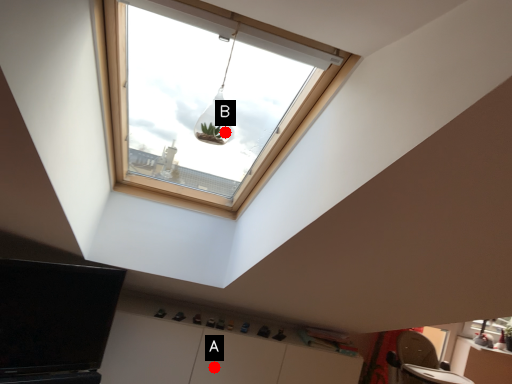
Question: Two points are circled on the image, labeled by A and B beside each circle. Which point appears closest to the camera in this image?

Choices:
 (A) A is closer
 (B) B is closer

Answer: (A)